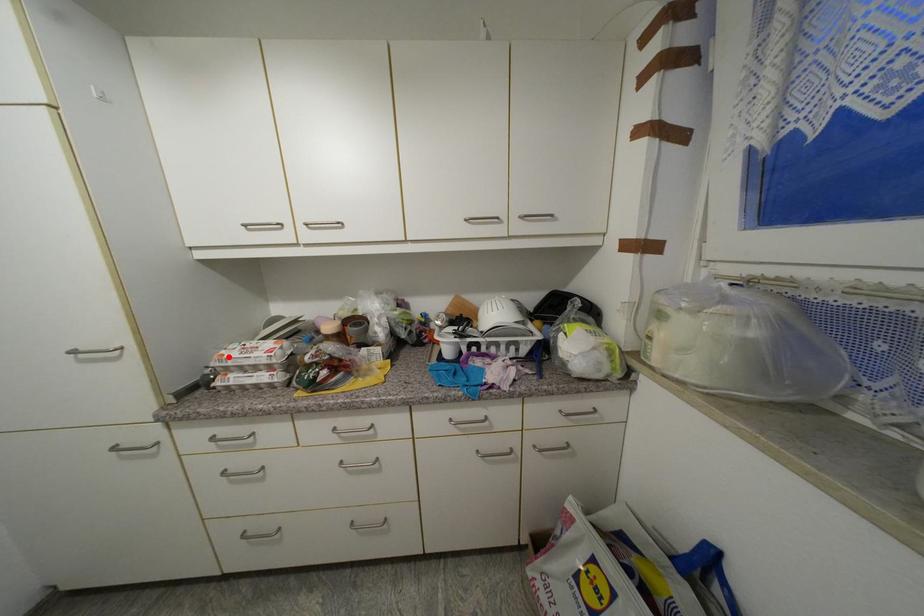
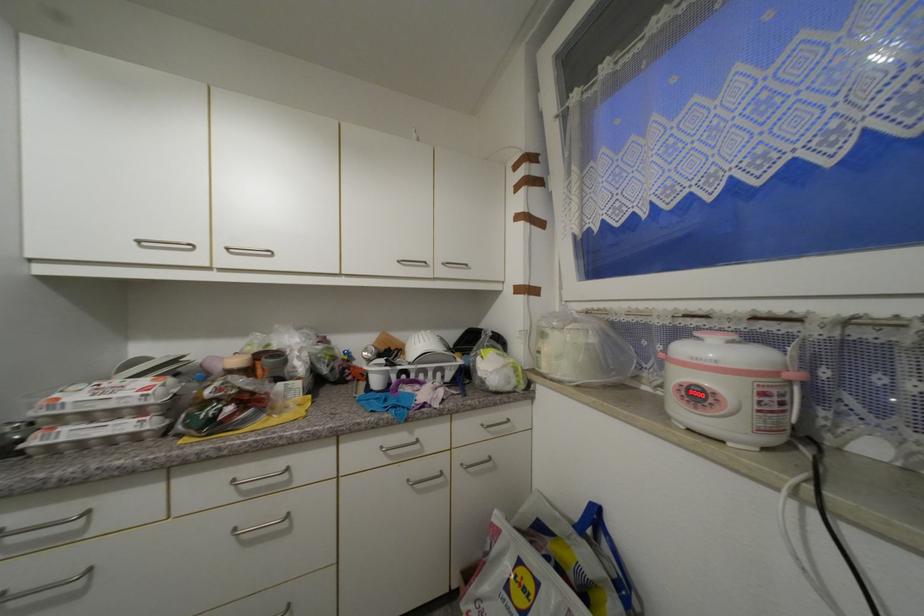
Question: I am providing you with two images of the same scene from different viewpoints. A red point is marked on the first image. Is the red point's position out of view in image 2?

Choices:
 (A) Yes
 (B) No

Answer: (B)